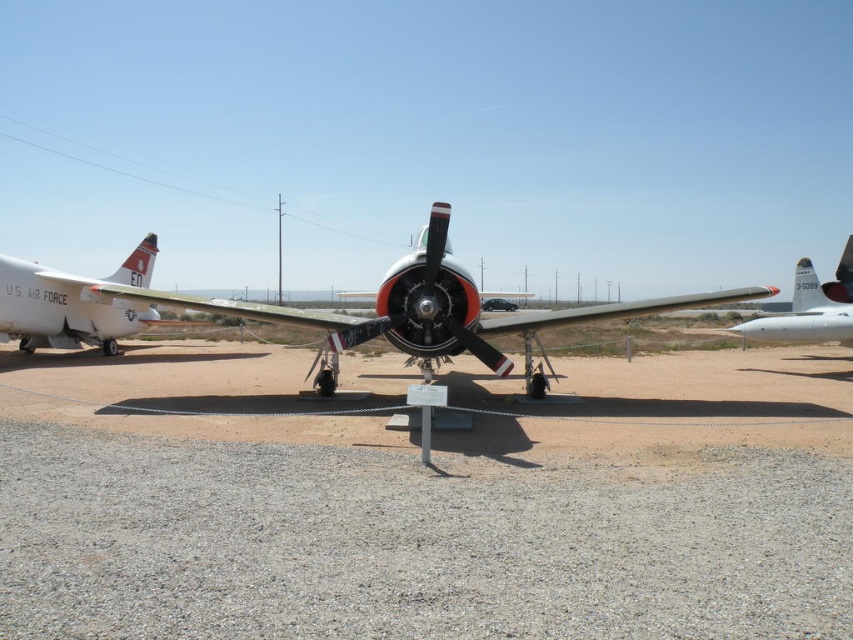
Does gray gravel at center have a lesser height compared to white matte airplane at left?

Yes, gray gravel at center is shorter than white matte airplane at left.

Is gray gravel at center closer to camera compared to white matte airplane at left?

Yes.

Where is `gray gravel at center`? gray gravel at center is located at coordinates (425, 499).

Identify the location of gray gravel at center. This screenshot has width=853, height=640. (425, 499).

Does gray gravel at center appear under polished silver propeller at center?

Indeed, gray gravel at center is positioned under polished silver propeller at center.

Based on the photo, is gray gravel at center wider than polished silver propeller at center?

Indeed, gray gravel at center has a greater width compared to polished silver propeller at center.

Is point (726, 460) positioned behind point (433, 252)?

That is False.

Identify the location of gray gravel at center. The height and width of the screenshot is (640, 853). (425, 499).

Is metallic silver airplane at center bigger than white matte airplane at left?

No.

The height and width of the screenshot is (640, 853). Identify the location of metallic silver airplane at center. (428, 310).

Is point (466, 278) in front of point (22, 276)?

Yes, point (466, 278) is in front of point (22, 276).

Identify the location of metallic silver airplane at center. (428, 310).